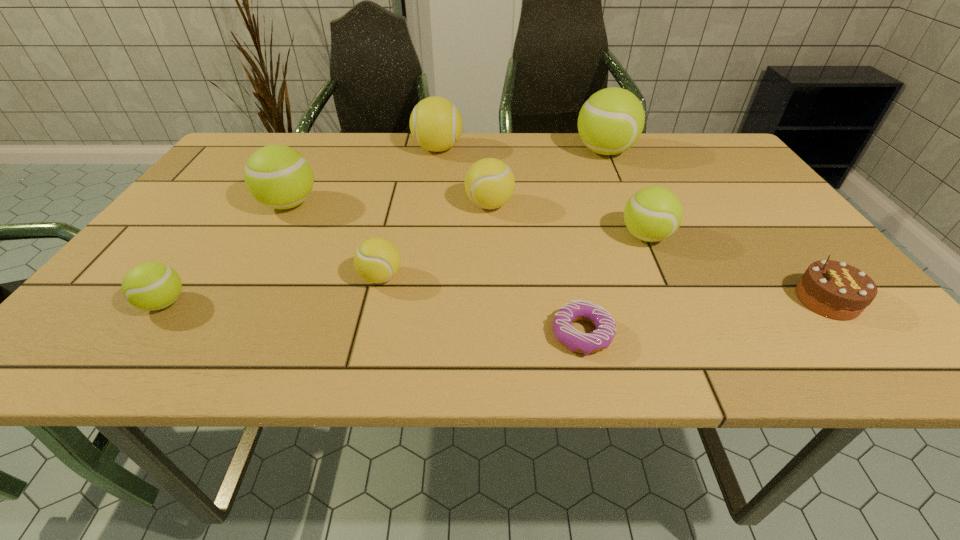
In order to click on the leftmost tennis ball in this screenshot , I will do `click(151, 286)`.

This screenshot has height=540, width=960. Find the location of `brown chocolate cake`. brown chocolate cake is located at coordinates (x=833, y=289).

The width and height of the screenshot is (960, 540). Identify the location of chocolate cake. (833, 289).

Find the location of a particular element. The image size is (960, 540). doughnut is located at coordinates (576, 341).

Locate an element on the screen. This screenshot has width=960, height=540. the shortest object is located at coordinates pyautogui.click(x=576, y=341).

I want to click on vacant space situated 0.110m on the right of the farthest green tennis ball, so click(673, 152).

What are the coordinates of `free location located on the front of the biggest yellow tennis ball` in the screenshot? It's located at (423, 246).

This screenshot has height=540, width=960. What are the coordinates of `blank space located 0.250m on the back of the second green tennis ball from left to right` in the screenshot? It's located at (323, 144).

Identify the location of vacant space positioned on the back of the second smallest yellow tennis ball. This screenshot has width=960, height=540. (488, 136).

Locate an element on the screen. This screenshot has width=960, height=540. vacant space located on the left of the third biggest green tennis ball is located at coordinates (491, 237).